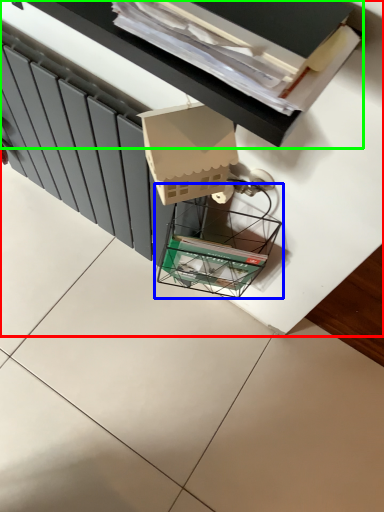
Question: Which object is positioned farthest from furniture (highlighted by a red box)? Select from glass box (highlighted by a blue box) and vanity (highlighted by a green box).

Choices:
 (A) glass box
 (B) vanity

Answer: (B)